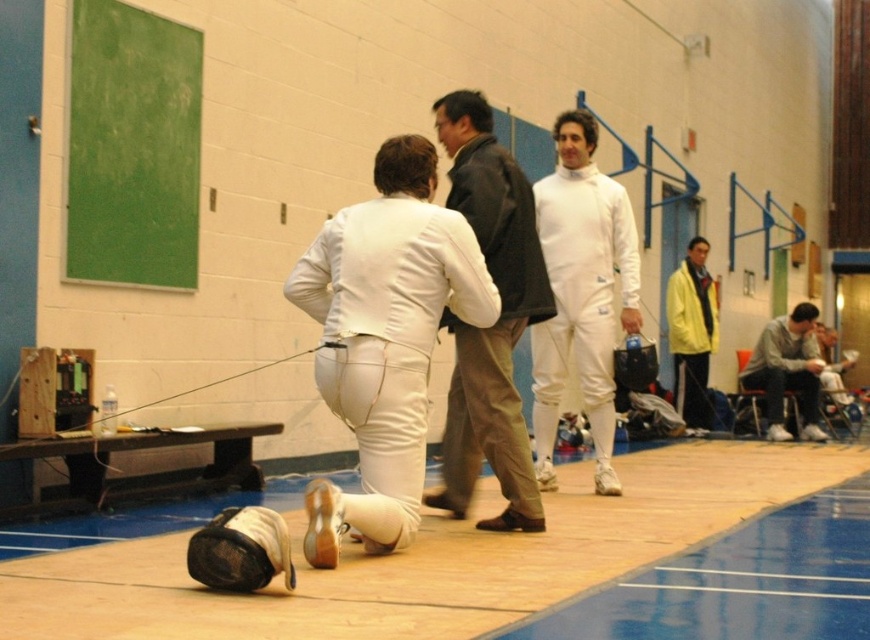
Question: Which is nearer to the white leather jacket at center?

Choices:
 (A) yellow jacket at right
 (B) gray cotton sweatshirt at right
 (C) white leather fencing suit at center

Answer: (C)

Question: Is white leather jacket at center below yellow jacket at right?

Choices:
 (A) yes
 (B) no

Answer: (B)

Question: Is white leather jacket at center bigger than white leather fencing suit at center?

Choices:
 (A) no
 (B) yes

Answer: (A)

Question: Which point is closer to the camera taking this photo?

Choices:
 (A) (773, 362)
 (B) (432, 109)
 (C) (561, 250)

Answer: (B)

Question: Is white leather jacket at center closer to the viewer compared to white leather fencing suit at center?

Choices:
 (A) yes
 (B) no

Answer: (A)

Question: Which object is positioned farthest from the white leather jacket at center?

Choices:
 (A) yellow jacket at right
 (B) gray cotton sweatshirt at right
 (C) white leather fencing suit at center

Answer: (B)